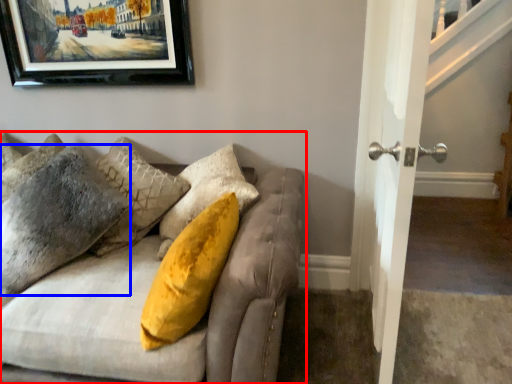
Question: Among these objects, which one is nearest to the camera, studio couch (highlighted by a red box) or pillow (highlighted by a blue box)?

Choices:
 (A) studio couch
 (B) pillow

Answer: (A)